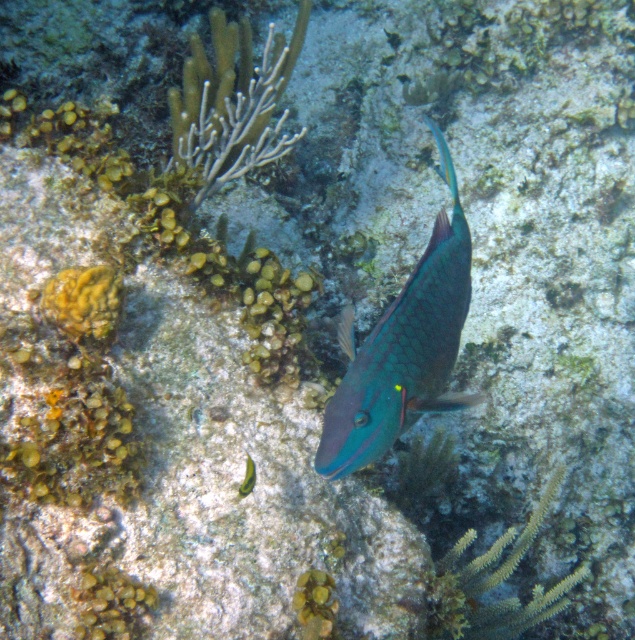
Question: Which point appears closest to the camera in this image?

Choices:
 (A) (250, 472)
 (B) (441, 384)

Answer: (B)

Question: Which object appears closest to the camera in this image?

Choices:
 (A) green matte fish at center
 (B) shiny teal fish at center

Answer: (B)

Question: Where is shiny teal fish at center located in relation to green matte fish at center in the image?

Choices:
 (A) above
 (B) below

Answer: (A)

Question: Which of the following is the closest to the observer?

Choices:
 (A) shiny teal fish at center
 (B) green matte fish at center

Answer: (A)

Question: Is shiny teal fish at center above green matte fish at center?

Choices:
 (A) yes
 (B) no

Answer: (A)

Question: From the image, what is the correct spatial relationship of shiny teal fish at center in relation to green matte fish at center?

Choices:
 (A) left
 (B) right

Answer: (B)